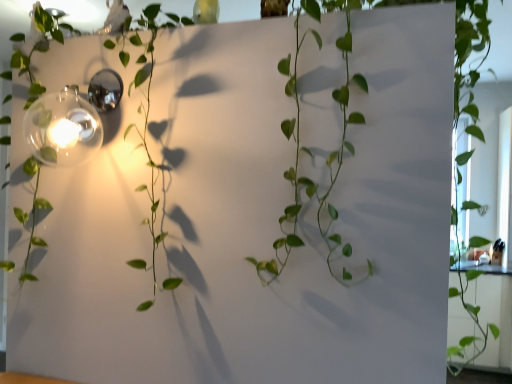
Question: Should I look upward or downward to see polished chrome light fixture at upper left?

Choices:
 (A) up
 (B) down

Answer: (A)